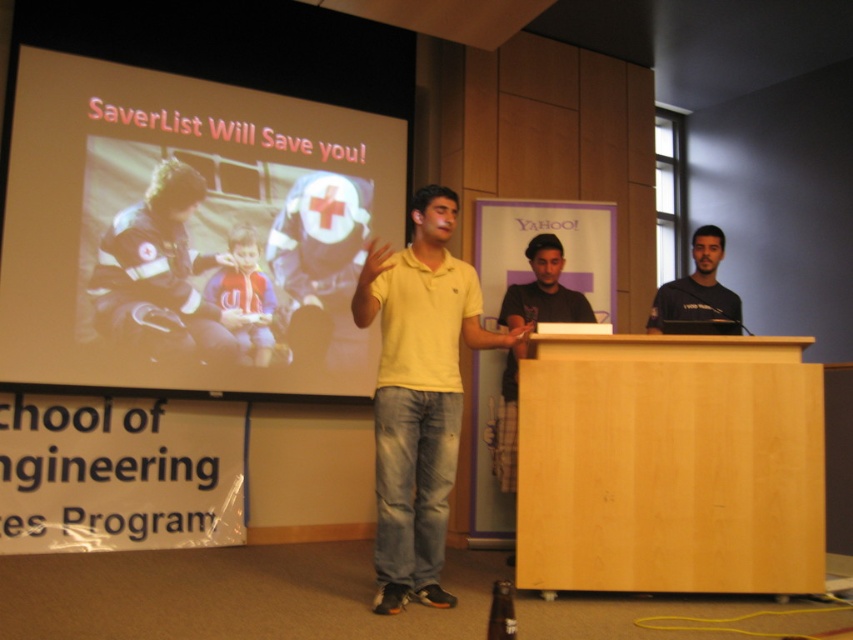
Question: Which point appears closest to the camera in this image?

Choices:
 (A) (428, 372)
 (B) (695, 237)

Answer: (A)

Question: Can you confirm if light brown wood podium at center is positioned to the left of yellow cotton shirt at center?

Choices:
 (A) no
 (B) yes

Answer: (A)

Question: Based on their relative distances, which object is farther from the yellow cotton shirt at center?

Choices:
 (A) light brown wood podium at center
 (B) dark gray t-shirt at center

Answer: (B)

Question: Can you confirm if light brown wood podium at center is bigger than dark gray t-shirt at center?

Choices:
 (A) yes
 (B) no

Answer: (A)

Question: Which point is farther from the camera taking this photo?

Choices:
 (A) (599, 516)
 (B) (91, 301)
 (C) (413, 456)
 (D) (117, 163)

Answer: (D)

Question: Is matte plastic projector screen at upper left smaller than light brown wood podium at center?

Choices:
 (A) yes
 (B) no

Answer: (B)